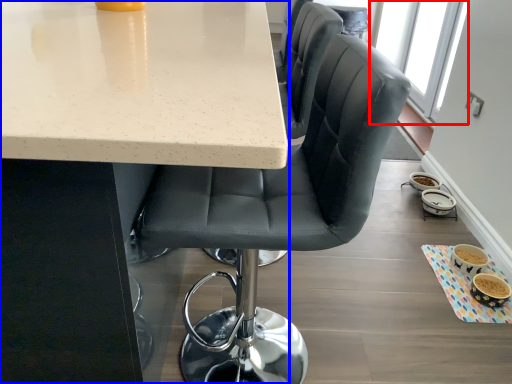
Question: Which of the following is the farthest to the observer, window screen (highlighted by a red box) or table (highlighted by a blue box)?

Choices:
 (A) window screen
 (B) table

Answer: (A)